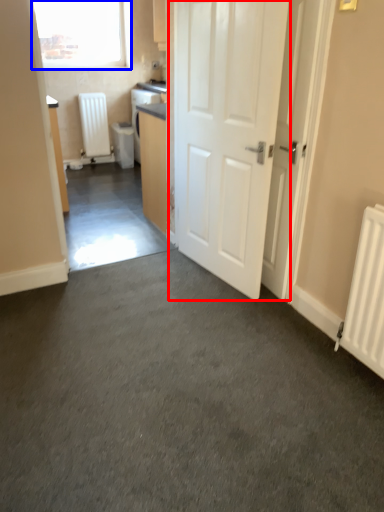
Question: Which object appears farthest to the camera in this image, door (highlighted by a red box) or window (highlighted by a blue box)?

Choices:
 (A) door
 (B) window

Answer: (B)